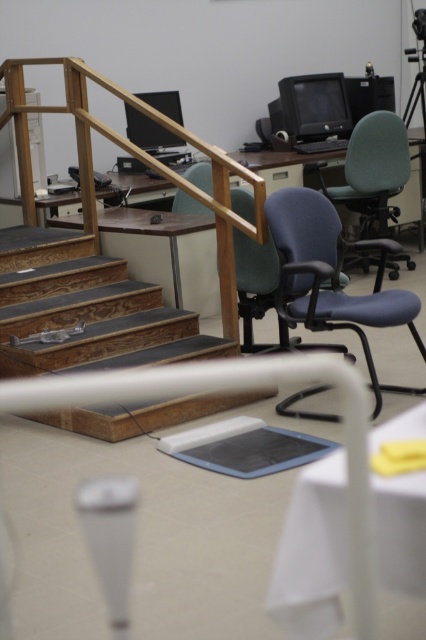
Looking at this image, who is higher up, matte white table at center or matte green swivel chair at center right?

matte green swivel chair at center right

Is point (192, 216) more distant than point (379, 144)?

No, it is not.

The image size is (426, 640). I want to click on matte white table at center, so click(x=166, y=253).

Does wooden stairs at center have a greater width compared to blue fabric swivel chair at center?

Correct, the width of wooden stairs at center exceeds that of blue fabric swivel chair at center.

Based on the photo, does wooden stairs at center have a lesser width compared to blue fabric swivel chair at center?

In fact, wooden stairs at center might be wider than blue fabric swivel chair at center.

Identify the location of wooden stairs at center. 86,308.

Who is lower down, wooden stairs at center or matte white table at center?

wooden stairs at center is lower down.

Who is higher up, wooden stairs at center or matte white table at center?

matte white table at center is higher up.

Is point (94, 300) less distant than point (164, 257)?

That is True.

Find the location of a particular element. This screenshot has height=640, width=426. wooden stairs at center is located at coordinates (86, 308).